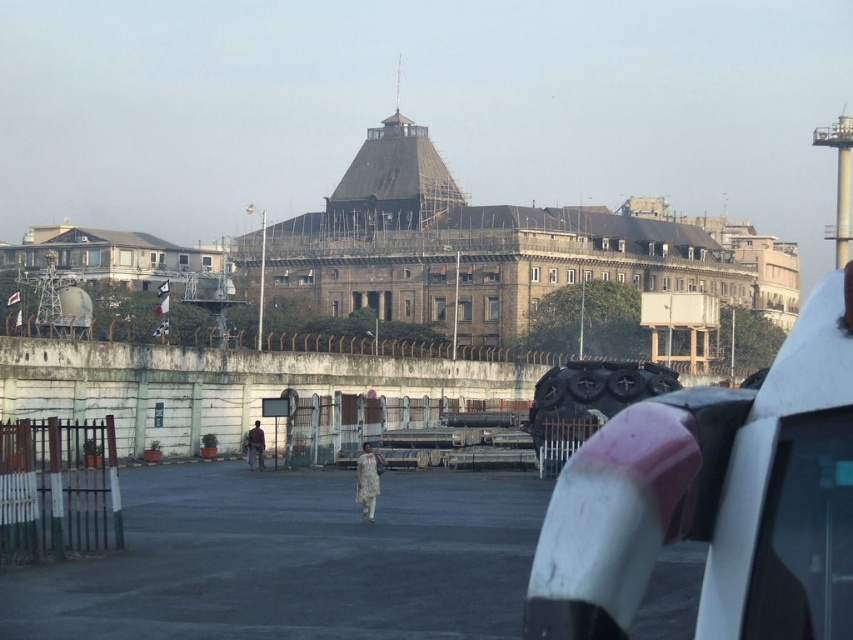
Does point (15, 256) come closer to viewer compared to point (263, 451)?

No, (15, 256) is further to viewer.

Find the location of a particular element. This screenshot has width=853, height=640. brown stone building at upper left is located at coordinates (111, 256).

I want to click on brown stone building at upper left, so click(111, 256).

At what (x,y) coordinates should I click in order to perform the action: click on brown stone building at upper left. Please return your answer as a coordinate pair (x, y). Image resolution: width=853 pixels, height=640 pixels. Looking at the image, I should click on (111, 256).

Consider the image. Between dull floral dress at center and light brown fabric dress at center, which one appears on the left side from the viewer's perspective?

From the viewer's perspective, light brown fabric dress at center appears more on the left side.

Who is higher up, dull floral dress at center or light brown fabric dress at center?

dull floral dress at center is above.

Measure the distance between dull floral dress at center and camera.

40.86 meters

Locate an element on the screen. dull floral dress at center is located at coordinates (368, 480).

Does point (90, 240) lie in front of point (361, 458)?

No, it is behind (361, 458).

Measure the distance between brown stone building at upper left and camera.

brown stone building at upper left and camera are 95.33 meters apart.

This screenshot has width=853, height=640. I want to click on brown stone building at upper left, so click(x=111, y=256).

I want to click on brown stone building at upper left, so click(111, 256).